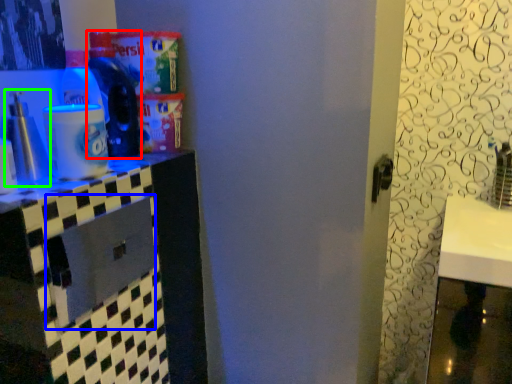
Question: Considering the real-world distances, which object is closest to bottle (highlighted by a red box)? drawer (highlighted by a blue box) or bottle (highlighted by a green box).

Choices:
 (A) drawer
 (B) bottle

Answer: (B)